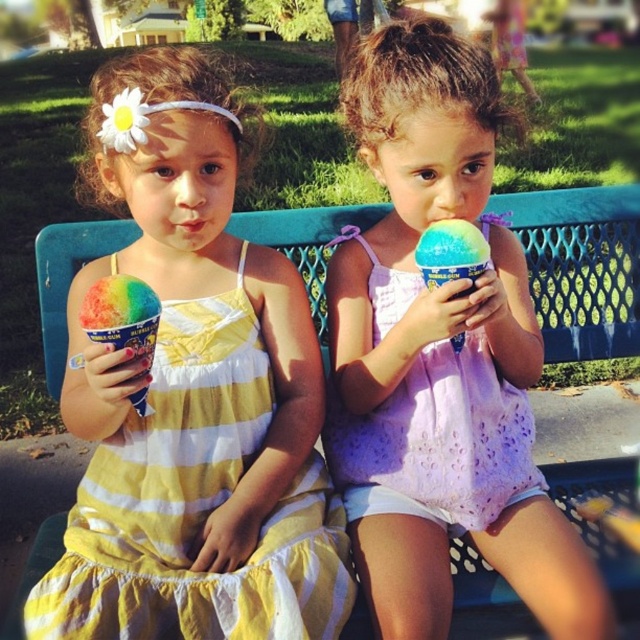
Question: Can you confirm if pastel purple fabric dress at center is positioned above pastel rainbow ice cream at center?

Choices:
 (A) no
 (B) yes

Answer: (A)

Question: Is lavender sheer top at center wider than rainbow ice cream at left?

Choices:
 (A) no
 (B) yes

Answer: (B)

Question: Which object is farther from the camera taking this photo?

Choices:
 (A) yellow striped fabric dress at left
 (B) lavender sheer top at center

Answer: (B)

Question: Which point is farther from the camera taking this photo?

Choices:
 (A) (323, 497)
 (B) (435, 272)
 (C) (349, 413)

Answer: (C)

Question: Which of the following is the farthest from the observer?

Choices:
 (A) lavender sheer top at center
 (B) yellow striped fabric dress at left

Answer: (A)

Question: Where is lavender sheer top at center located in relation to pastel rainbow ice cream at center in the image?

Choices:
 (A) below
 (B) above

Answer: (A)